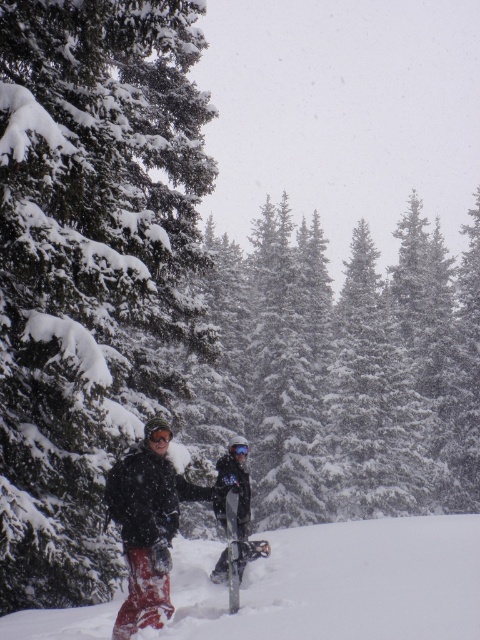
You are a photographer trying to capture a photo of both the red snowboard at lower left and the snowboard at center. Since you want them to appear side by side in the photo, which snowboard should you position to the right in your camera frame?

The red snowboard at lower left is positioned on the right side of snowboard at center, so to have them appear side by side, you should position the red snowboard at lower left to the right in your camera frame.

Based on the photo, you are a winter sports instructor planning to store the snowboard at center and the matte black snowshoe at center in a storage locker. The locker has a maximum capacity of 1.2 meters in length. Can both items be stored without exceeding the locker length limit?

The snowboard at center is bigger than the matte black snowshoe at center. Since the snowboard is larger, if the snowboard alone is under 1.2 meters, both can fit. However, if the snowboard exceeds 1.2 meters, neither can fit. Without exact measurements, we cannot confirm. But since the snowboard is bigger, it determines the limit.